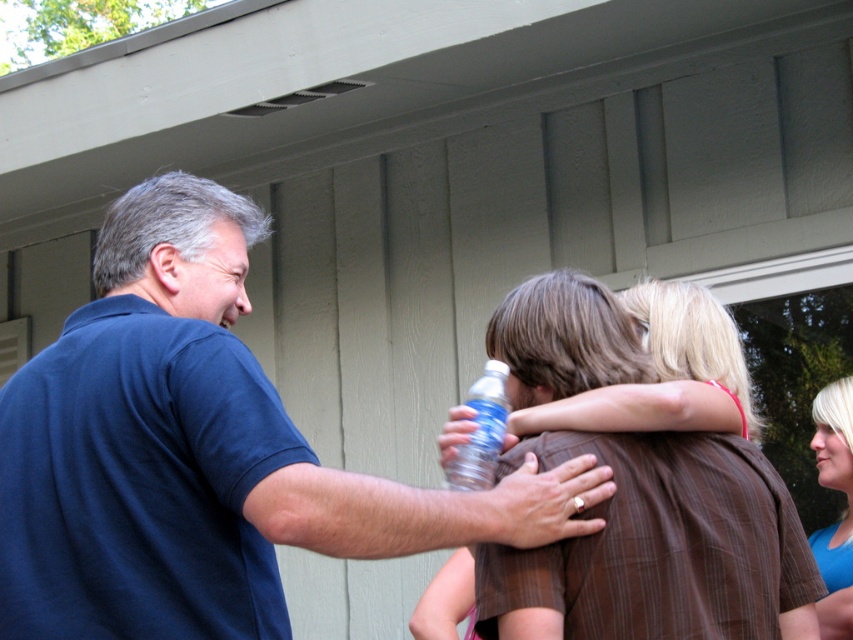
Question: Is blue cotton shirt at center thinner than blonde hair at upper right?

Choices:
 (A) no
 (B) yes

Answer: (A)

Question: Does blue cotton shirt at center appear on the right side of clear plastic bottle at center?

Choices:
 (A) no
 (B) yes

Answer: (A)

Question: Among these objects, which one is farthest from the camera?

Choices:
 (A) blue cotton shirt at center
 (B) blonde hair at center

Answer: (B)

Question: Which point is closer to the camera?

Choices:
 (A) blue cotton shirt at center
 (B) blonde hair at center
 (C) blonde hair at upper right
 (D) clear plastic bottle at center

Answer: (A)

Question: Does blonde hair at center appear on the right side of clear plastic bottle at center?

Choices:
 (A) no
 (B) yes

Answer: (B)

Question: Considering the real-world distances, which object is closest to the blue cotton shirt at center?

Choices:
 (A) clear plastic bottle at center
 (B) blonde hair at upper right

Answer: (A)